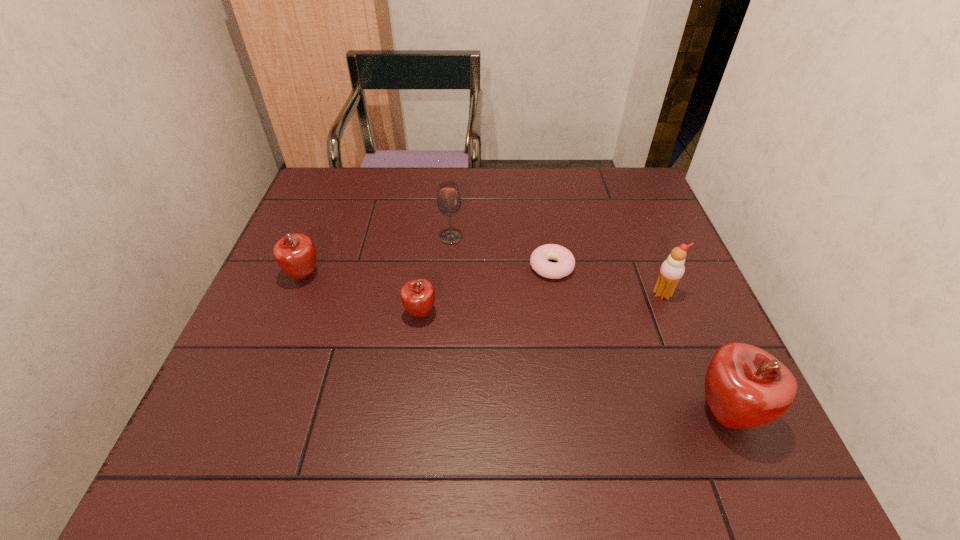
You are a GUI agent. You are given a task and a screenshot of the screen. Output one action in this format:
    pyautogui.click(x=<x>, y=<y>)
    Task: Click on the vacant point located between the shortest object and the icecream
    Image resolution: width=960 pixels, height=540 pixels.
    Given the screenshot: What is the action you would take?
    pyautogui.click(x=607, y=280)

Find the location of a particular element. Image resolution: width=960 pixels, height=540 pixels. free spot between the shortest apple and the farthest object is located at coordinates 436,276.

Identify the location of free space between the nearest object and the icecream. (694, 354).

The image size is (960, 540). What are the coordinates of `free space that is in between the second nearest apple and the farthest apple` in the screenshot? It's located at (363, 294).

At what (x,y) coordinates should I click in order to perform the action: click on vacant area between the third object from right to left and the leftmost apple. Please return your answer as a coordinate pair (x, y). This screenshot has height=540, width=960. Looking at the image, I should click on (428, 271).

The width and height of the screenshot is (960, 540). Find the location of `object that ranks as the second closest to the glass drink container`. object that ranks as the second closest to the glass drink container is located at coordinates (417, 296).

Select which object appears as the second closest to the second shortest object. Please provide its 2D coordinates. Your answer should be formatted as a tuple, i.e. [(x, y)], where the tuple contains the x and y coordinates of a point satisfying the conditions above.

[(295, 253)]

The width and height of the screenshot is (960, 540). I want to click on the second closest apple to the icecream, so click(x=417, y=296).

Select which apple appears as the closest to the third object from right to left. Please provide its 2D coordinates. Your answer should be formatted as a tuple, i.e. [(x, y)], where the tuple contains the x and y coordinates of a point satisfying the conditions above.

[(417, 296)]

Identify the location of free region that satisfies the following two spatial constraints: 1. on the front side of the rightmost apple; 2. on the left side of the glass drink container. (439, 414).